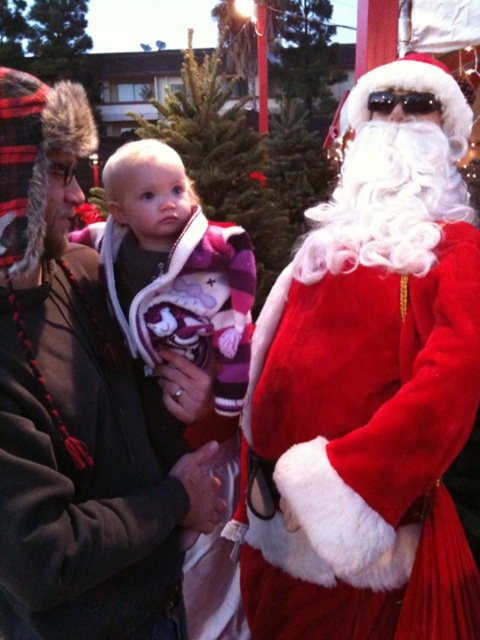
You are at a holiday party and want to take a photo with both the velvet red santa claus at right and the fuzzy fur hat at upper left. Which object should you stand closer to in order to include both in the frame?

Since the velvet red santa claus at right is taller than the fuzzy fur hat at upper left, you should stand closer to the fuzzy fur hat at upper left to ensure both objects are visible in the photo frame.

From the picture: You are standing in the festive outdoor scene and want to take a photo with the velvet red santa claus at right. Where should you position yourself to ensure the santa claus is in the frame?

The velvet red santa claus at right is located at point (369,385), so you should position yourself facing that coordinate to include the santa claus in your photo.

Based on the photo, you are standing in the festive outdoor scene and want to take a photo of the two points mentioned. Which point, point [283,305] or point [124,524], is closer to you?

Point [283,305] is closer to you because it is further to the viewer than point [124,524].